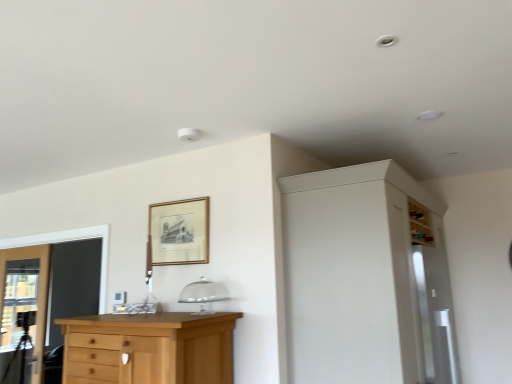
Question: Considering the positions of point (4, 266) and point (204, 382), is point (4, 266) closer or farther from the camera than point (204, 382)?

Choices:
 (A) farther
 (B) closer

Answer: (A)

Question: In terms of height, does clear glass door at left look taller or shorter compared to light brown wood chest of drawers at lower left?

Choices:
 (A) short
 (B) tall

Answer: (B)

Question: Which object is the farthest from the light brown wood chest of drawers at lower left?

Choices:
 (A) white matte cabinet at upper right
 (B) clear glass door at left
 (C) gold wooden picture frame at upper center
 (D) transparent glass screen door at right

Answer: (B)

Question: Considering the real-world distances, which object is farthest from the transparent glass screen door at right?

Choices:
 (A) light brown wood chest of drawers at lower left
 (B) gold wooden picture frame at upper center
 (C) white matte cabinet at upper right
 (D) clear glass door at left

Answer: (D)